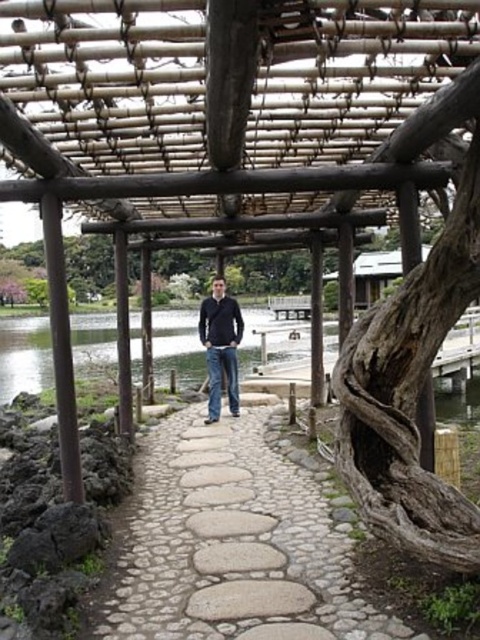
Question: Can you confirm if clear water at center is thinner than dark blue jeans at center?

Choices:
 (A) no
 (B) yes

Answer: (B)

Question: Can you confirm if clear water at center is thinner than dark blue jeans at center?

Choices:
 (A) no
 (B) yes

Answer: (B)

Question: Based on their relative distances, which object is nearer to the dark blue jeans at center?

Choices:
 (A) natural stone pathway at center
 (B) clear water at center

Answer: (A)

Question: Is the position of natural stone pathway at center more distant than that of clear water at center?

Choices:
 (A) no
 (B) yes

Answer: (A)

Question: Which object is the farthest from the dark blue jeans at center?

Choices:
 (A) natural stone pathway at center
 (B) clear water at center

Answer: (B)

Question: Estimate the real-world distances between objects in this image. Which object is closer to the clear water at center?

Choices:
 (A) dark blue jeans at center
 (B) natural stone pathway at center

Answer: (A)